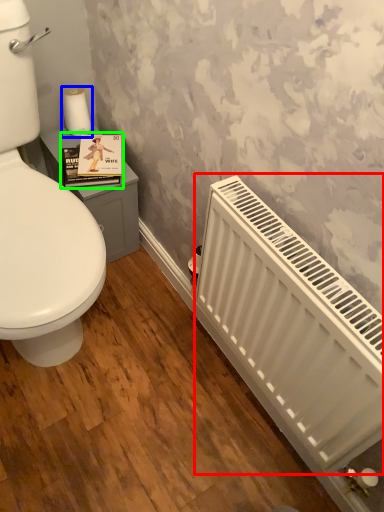
Question: Estimate the real-world distances between objects in this image. Which object is closer to radiator (highlighted by a red box), toilet paper (highlighted by a blue box) or book cover (highlighted by a green box)?

Choices:
 (A) toilet paper
 (B) book cover

Answer: (B)